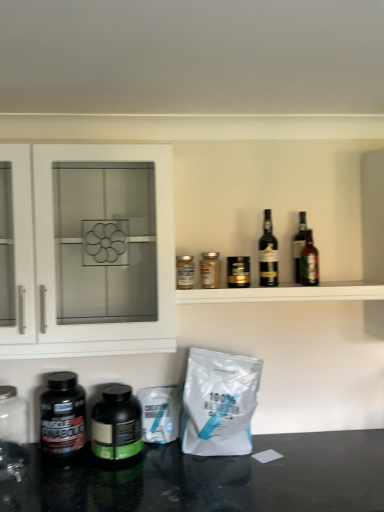
Question: Does gold metallic can at center have a greater width compared to metallic gold jar at upper center, the 4th bottle from the right?

Choices:
 (A) no
 (B) yes

Answer: (B)

Question: From the image's perspective, is gold metallic can at center on metallic gold jar at upper center, the 4th bottle from the right?

Choices:
 (A) no
 (B) yes

Answer: (B)

Question: Could you tell me if gold metallic can at center is turned towards metallic gold jar at upper center, the fourth bottle in the left-to-right sequence?

Choices:
 (A) yes
 (B) no

Answer: (B)

Question: Can you confirm if gold metallic can at center is taller than metallic gold jar at upper center, the 4th bottle from the right?

Choices:
 (A) no
 (B) yes

Answer: (A)

Question: Can metallic gold jar at upper center, the 4th bottle from the right, be found inside gold metallic can at center?

Choices:
 (A) no
 (B) yes

Answer: (A)

Question: From the image's perspective, is gold metallic can at center located beneath metallic gold jar at upper center, the fourth bottle in the left-to-right sequence?

Choices:
 (A) no
 (B) yes

Answer: (A)

Question: From the image's perspective, would you say transparent glass jar at lower left is shown under brown glass bottle at upper right, placed as the 1th bottle when sorted from right to left?

Choices:
 (A) yes
 (B) no

Answer: (A)

Question: Would you say transparent glass jar at lower left is outside brown glass bottle at upper right, arranged as the seventh bottle when viewed from the left?

Choices:
 (A) no
 (B) yes

Answer: (B)

Question: Is transparent glass jar at lower left wider than brown glass bottle at upper right, arranged as the seventh bottle when viewed from the left?

Choices:
 (A) yes
 (B) no

Answer: (A)

Question: From the image's perspective, is transparent glass jar at lower left above brown glass bottle at upper right, arranged as the seventh bottle when viewed from the left?

Choices:
 (A) yes
 (B) no

Answer: (B)

Question: Is transparent glass jar at lower left smaller than brown glass bottle at upper right, placed as the 1th bottle when sorted from right to left?

Choices:
 (A) no
 (B) yes

Answer: (A)

Question: Considering the relative sizes of transparent glass jar at lower left and brown glass bottle at upper right, placed as the 1th bottle when sorted from right to left, in the image provided, is transparent glass jar at lower left taller than brown glass bottle at upper right, placed as the 1th bottle when sorted from right to left,?

Choices:
 (A) yes
 (B) no

Answer: (A)

Question: Considering the relative positions of transparent glass jar at lower left and black plastic bottle at lower left, arranged as the 7th bottle when viewed from the right, in the image provided, is transparent glass jar at lower left in front of black plastic bottle at lower left, arranged as the 7th bottle when viewed from the right,?

Choices:
 (A) no
 (B) yes

Answer: (B)